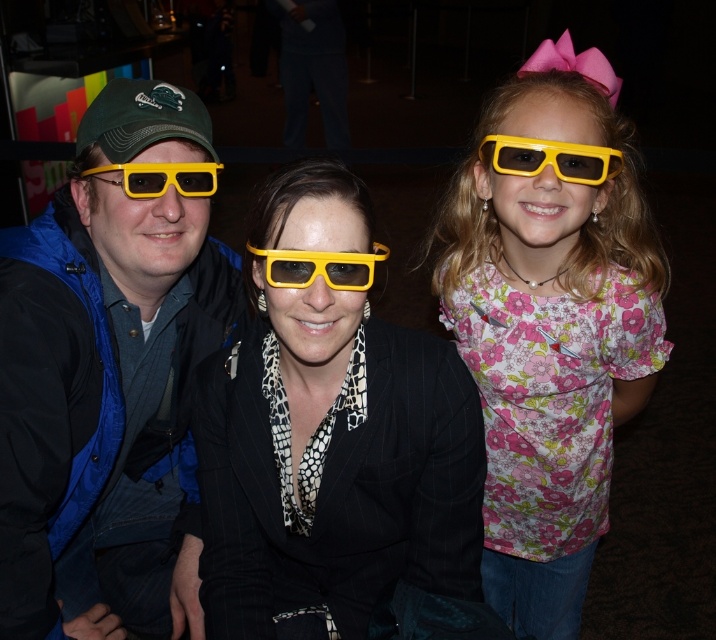
At what (x,y) coordinates should I click in order to perform the action: click on yellow matte plastic goggles at center. Please return your answer as a coordinate pair (x, y). This screenshot has height=640, width=716. Looking at the image, I should click on (319, 266).

Who is positioned more to the left, yellow matte plastic goggles at center or yellow matte 3d glasses at left?

yellow matte 3d glasses at left

Between point (367, 273) and point (102, 179), which one is positioned in front?

Point (367, 273) is more forward.

This screenshot has height=640, width=716. I want to click on yellow matte plastic goggles at center, so click(319, 266).

Measure the distance between matte black suit at center and camera.

35.64 inches

Does point (387, 497) come farther from viewer compared to point (526, 595)?

No, (387, 497) is closer to viewer.

Which is behind, point (448, 513) or point (586, 118)?

The point (448, 513) is behind.

Locate an element on the screen. The height and width of the screenshot is (640, 716). matte black suit at center is located at coordinates (329, 435).

In the scene shown: Can you confirm if matte black suit at center is positioned to the right of yellow plastic goggles at upper right?

No, matte black suit at center is not to the right of yellow plastic goggles at upper right.

The width and height of the screenshot is (716, 640). Describe the element at coordinates (329, 435) in the screenshot. I see `matte black suit at center` at that location.

Where is `matte black suit at center`? This screenshot has width=716, height=640. matte black suit at center is located at coordinates (329, 435).